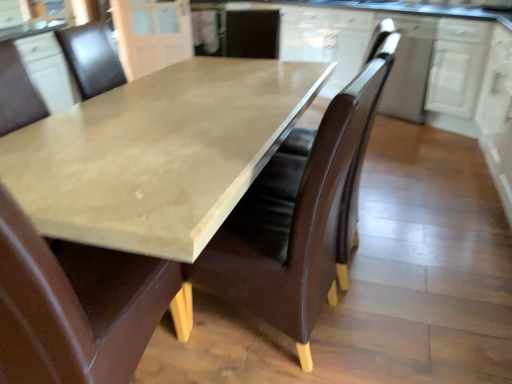
Identify the location of empty space that is to the right of brown leather swivel chair at center. This screenshot has height=384, width=512. (412, 261).